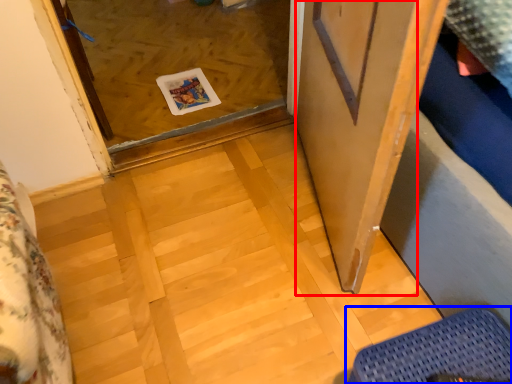
Question: Among these objects, which one is farthest to the camera, screen door (highlighted by a red box) or furniture (highlighted by a blue box)?

Choices:
 (A) screen door
 (B) furniture

Answer: (B)